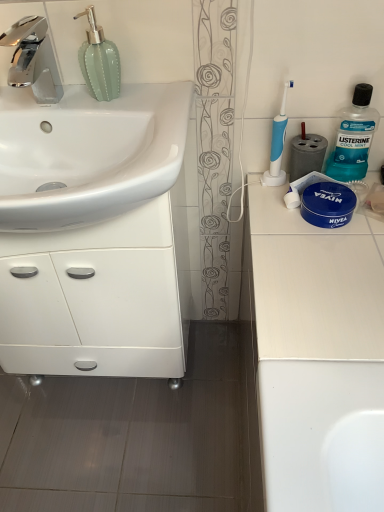
In order to click on vacant area that is in front of blue plastic toothbrush at upper right in this screenshot , I will do `click(289, 229)`.